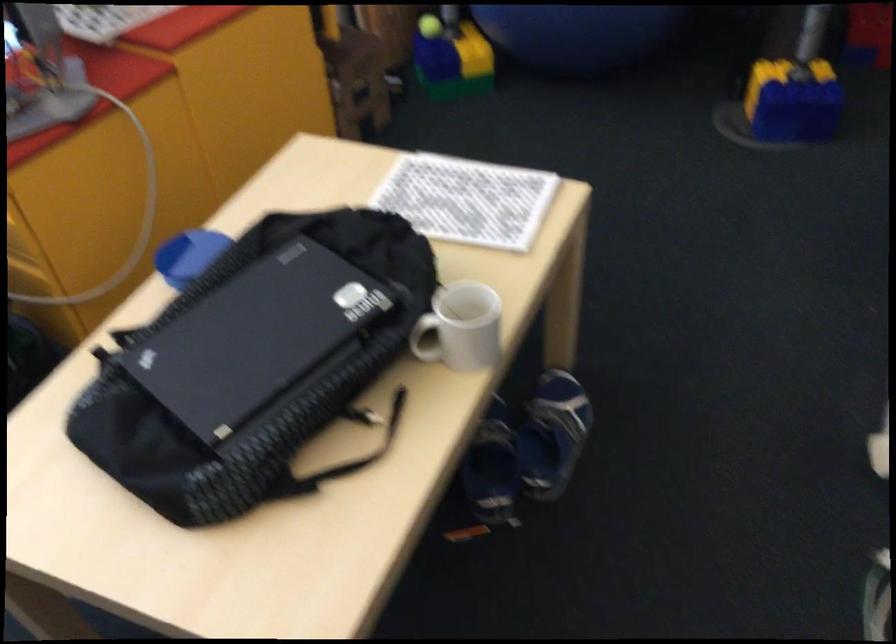
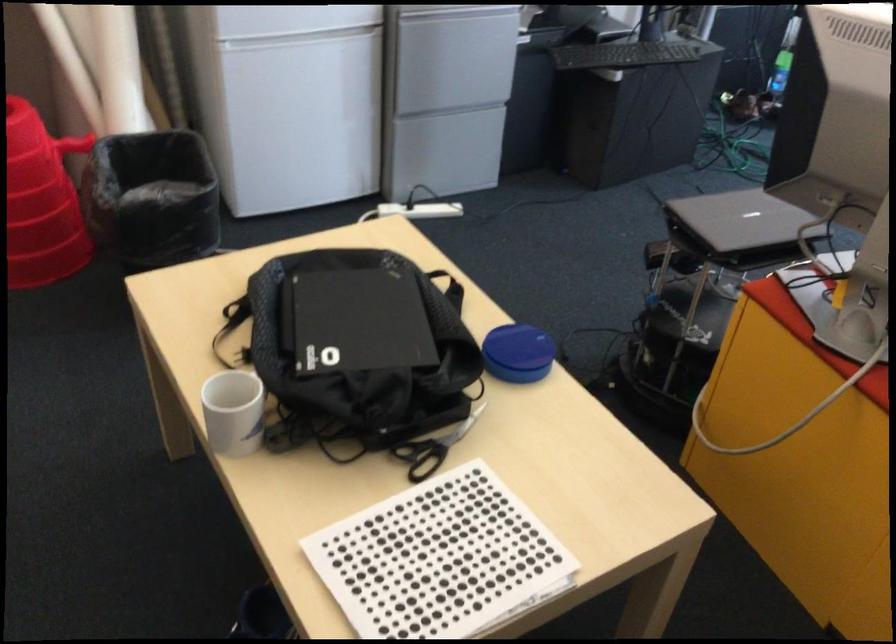
The point at (285, 337) is marked in the first image. Where is the corresponding point in the second image?

(355, 321)